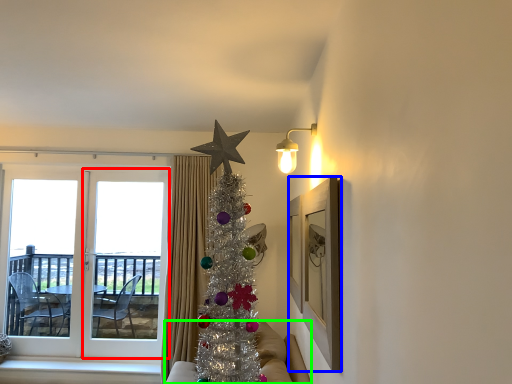
Question: Which object is the farthest from screen door (highlighted by a red box)? Choose among these: picture frame (highlighted by a blue box) or studio couch (highlighted by a green box).

Choices:
 (A) picture frame
 (B) studio couch

Answer: (A)